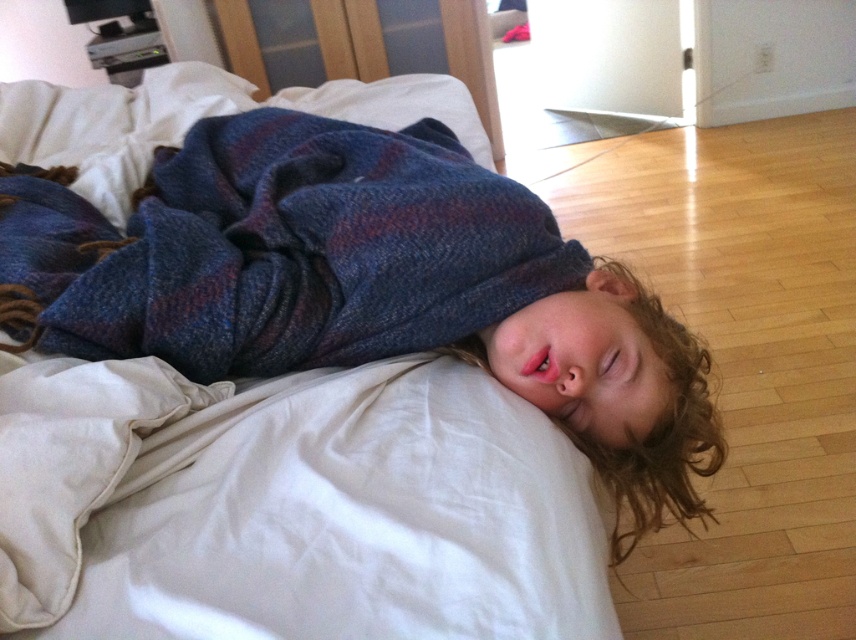
Question: Does blue woolen blanket at center come in front of plaid wool blanket at center?

Choices:
 (A) yes
 (B) no

Answer: (A)

Question: Which of the following is the farthest from the observer?

Choices:
 (A) plaid wool blanket at center
 (B) blue woolen blanket at center

Answer: (A)

Question: Can you confirm if blue woolen blanket at center is positioned below plaid wool blanket at center?

Choices:
 (A) yes
 (B) no

Answer: (A)

Question: Does blue woolen blanket at center have a larger size compared to plaid wool blanket at center?

Choices:
 (A) no
 (B) yes

Answer: (B)